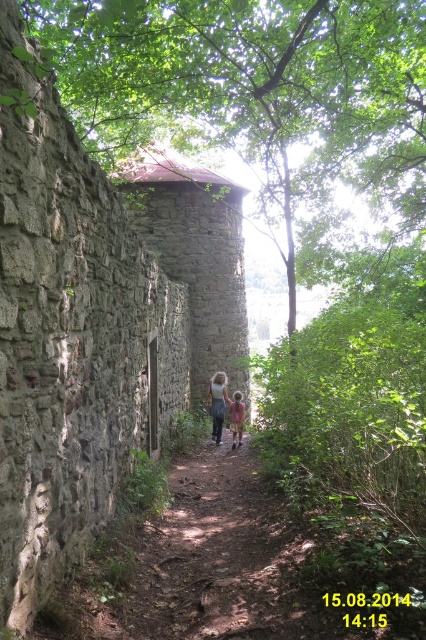
Does denim skirt at center appear on the left side of light pink cotton shirt at center?

Correct, you'll find denim skirt at center to the left of light pink cotton shirt at center.

Who is lower down, denim skirt at center or light pink cotton shirt at center?

light pink cotton shirt at center is below.

Which is in front, point (218, 372) or point (241, 406)?

Point (241, 406)

Where is `denim skirt at center`? This screenshot has height=640, width=426. denim skirt at center is located at coordinates (218, 403).